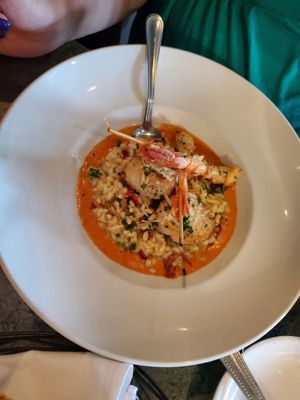
Where is `table`? The width and height of the screenshot is (300, 400). table is located at coordinates (21, 317).